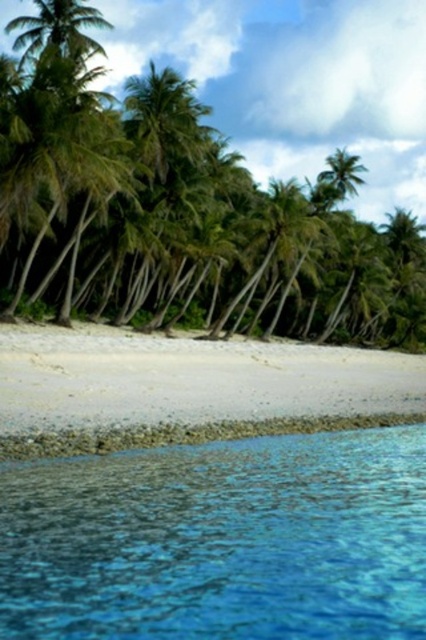
You are standing on the white sand beach at lower center and want to walk to the palm trees in the midground. Which direction should you move relative to the clear blue water at lower center?

You should move away from the clear blue water at lower center towards the palm trees in the midground since the white sand beach at lower center is behind the clear blue water at lower center.